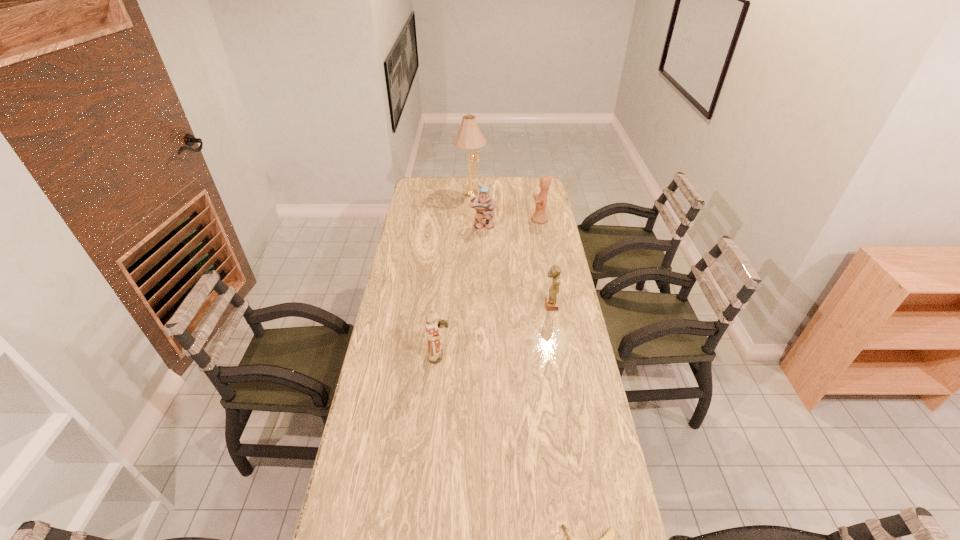
Identify which object is the second closest to the third figurine from right to left. Please provide its 2D coordinates. Your answer should be formatted as a tuple, i.e. [(x, y)], where the tuple contains the x and y coordinates of a point satisfying the conditions above.

[(469, 136)]

You are a GUI agent. You are given a task and a screenshot of the screen. Output one action in this format:
    pyautogui.click(x=<x>, y=<y>)
    Task: Click on the figurine that can be found as the third closest to the leftmost figurine
    The width and height of the screenshot is (960, 540).
    Given the screenshot: What is the action you would take?
    pyautogui.click(x=539, y=216)

Identify the location of the second closest figurine to the fourth farthest object. The image size is (960, 540). (484, 204).

Where is `free point that satisfies the following two spatial constraints: 1. on the front-facing side of the second figurine from left to right; 2. on the front-facing side of the leftmost figurine`? The image size is (960, 540). free point that satisfies the following two spatial constraints: 1. on the front-facing side of the second figurine from left to right; 2. on the front-facing side of the leftmost figurine is located at coordinates (484, 356).

Locate an element on the screen. The width and height of the screenshot is (960, 540). vacant space that satisfies the following two spatial constraints: 1. on the front-facing side of the second figurine from left to right; 2. on the front-facing side of the second nearest object is located at coordinates (484, 356).